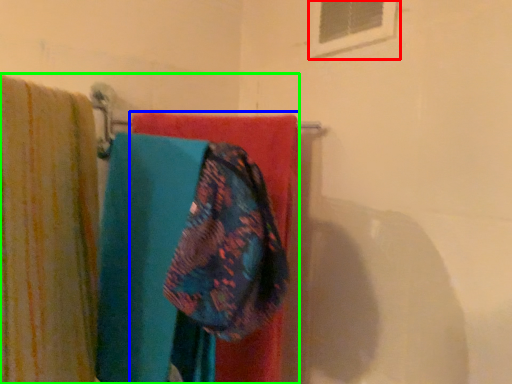
Question: Based on their relative distances, which object is nearer to window (highlighted by a red box)? Choose from towel (highlighted by a blue box) and laundry (highlighted by a green box).

Choices:
 (A) towel
 (B) laundry

Answer: (A)